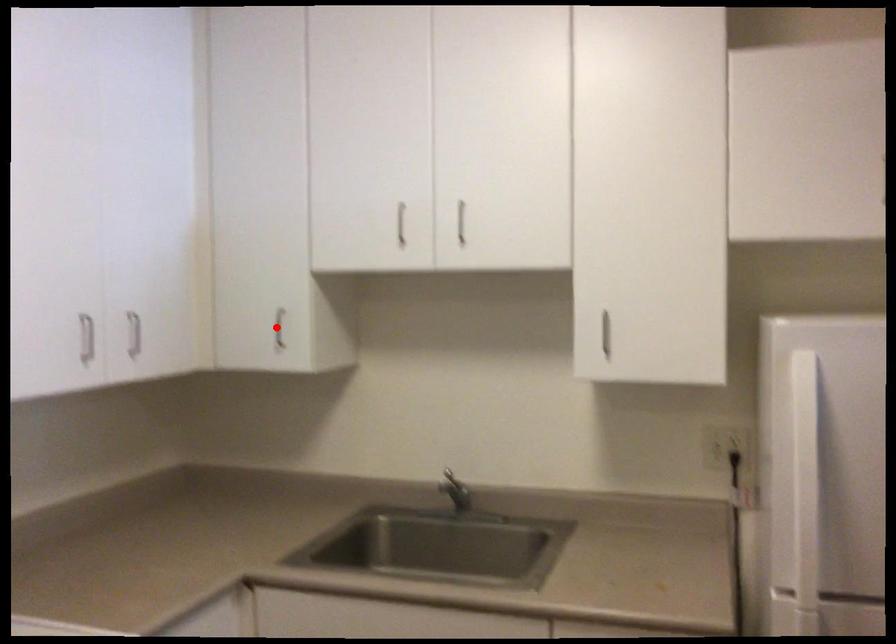
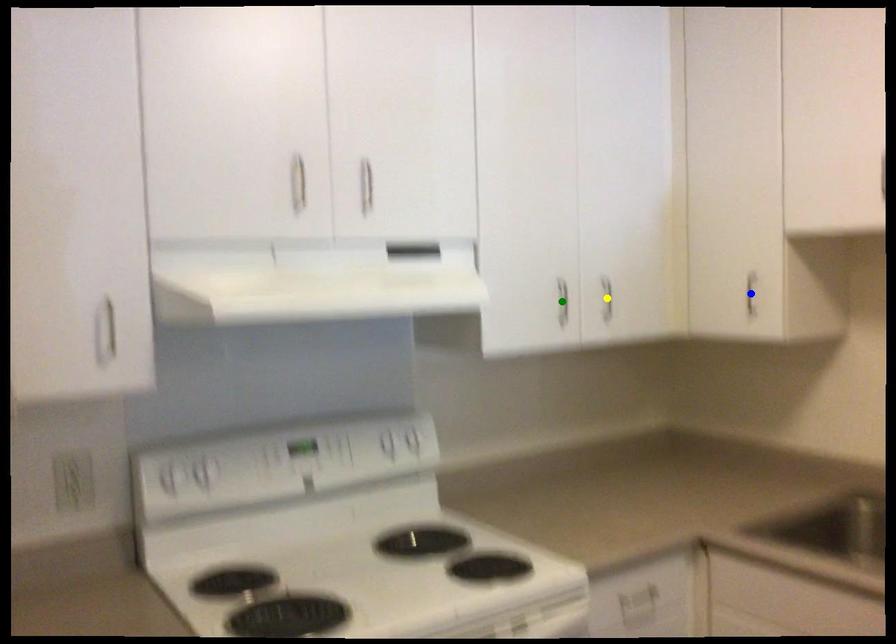
Question: I am providing you with two images of the same scene from different viewpoints. A red point is marked on the first image. You are given multiple points on the second image. Which point in image 2 is actually the same real-world point as the red point in image 1?

Choices:
 (A) yellow point
 (B) green point
 (C) blue point

Answer: (C)